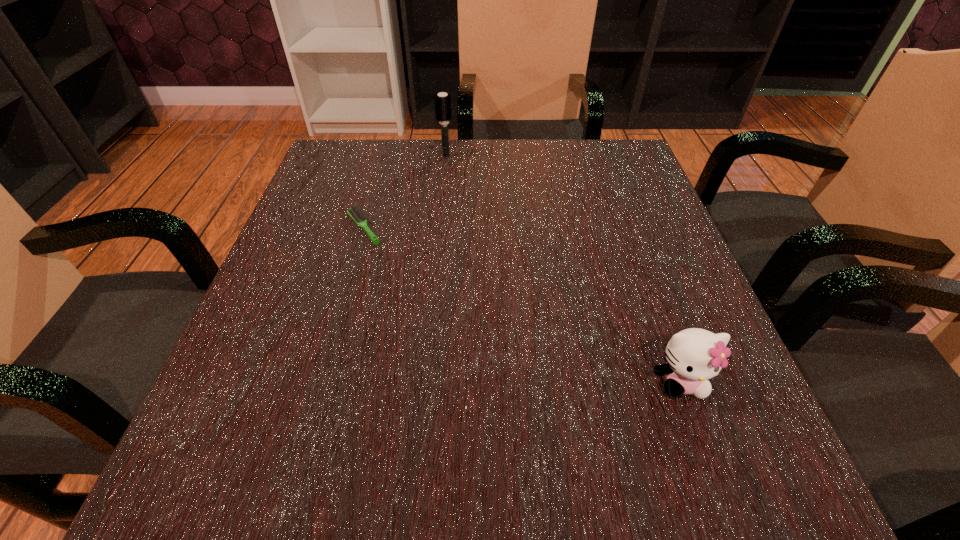
The width and height of the screenshot is (960, 540). In order to click on the right hairbrush in this screenshot , I will do `click(442, 101)`.

What are the coordinates of `the farther hairbrush` in the screenshot? It's located at point(442,101).

What are the coordinates of `the rightmost object` in the screenshot? It's located at (694, 355).

Where is `the second tallest object`? the second tallest object is located at coordinates (694, 355).

I want to click on the shortest object, so click(x=357, y=215).

You are a GUI agent. You are given a task and a screenshot of the screen. Output one action in this format:
    pyautogui.click(x=<x>, y=<y>)
    Task: Click on the second nearest object
    
    Given the screenshot: What is the action you would take?
    pyautogui.click(x=357, y=215)

Where is `free region located on the right of the right hairbrush`? The width and height of the screenshot is (960, 540). free region located on the right of the right hairbrush is located at coordinates (483, 156).

This screenshot has height=540, width=960. I want to click on vacant space located on the front-facing side of the nearest object, so click(720, 494).

This screenshot has width=960, height=540. I want to click on vacant space located on the back of the shorter hairbrush, so click(375, 189).

The width and height of the screenshot is (960, 540). I want to click on object positioned at the far edge, so click(x=442, y=101).